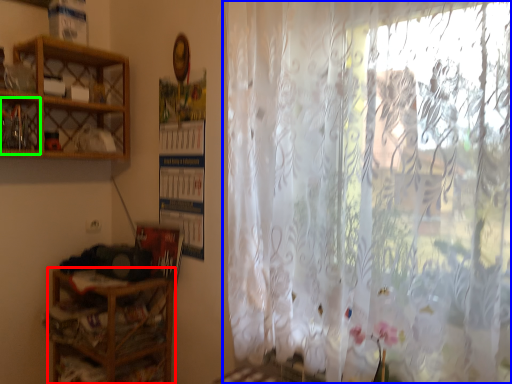
Question: Which is farther away from shelf (highlighted by a red box)? curtain (highlighted by a blue box) or cabinet (highlighted by a green box)?

Choices:
 (A) curtain
 (B) cabinet

Answer: (A)